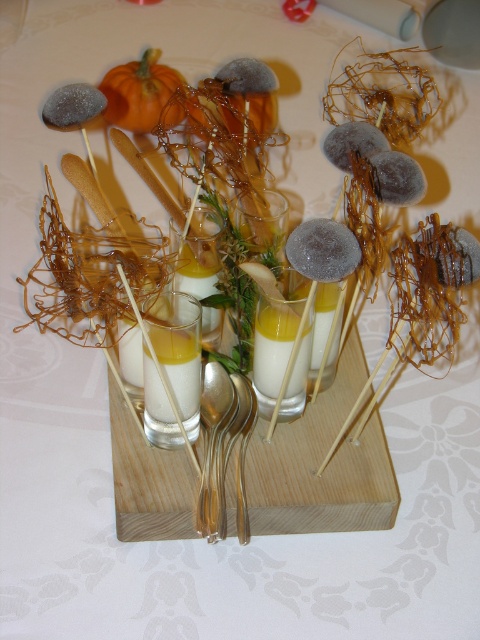
Is yellow translucent juice at center shorter than yellow translucent liquid at center?

Yes, yellow translucent juice at center is shorter than yellow translucent liquid at center.

Is point (187, 356) behind point (290, 326)?

No.

This screenshot has width=480, height=640. I want to click on yellow translucent juice at center, so click(x=180, y=364).

Between point (222, 428) and point (147, 369), which one is positioned in front?

Point (147, 369) is more forward.

Between gold metallic spoon at center and yellow translucent juice at center, which one appears on the right side from the viewer's perspective?

From the viewer's perspective, gold metallic spoon at center appears more on the right side.

Which is behind, point (231, 396) or point (177, 397)?

The point (231, 396) is more distant.

Find the location of `gold metallic spoon at center`. gold metallic spoon at center is located at coordinates (214, 449).

What do you see at coordinates (214, 449) in the screenshot?
I see `gold metallic spoon at center` at bounding box center [214, 449].

Is gold metallic spoon at center smaller than yellow translucent liquid at center?

Incorrect, gold metallic spoon at center is not smaller in size than yellow translucent liquid at center.

Where is `gold metallic spoon at center`? The height and width of the screenshot is (640, 480). gold metallic spoon at center is located at coordinates (214, 449).